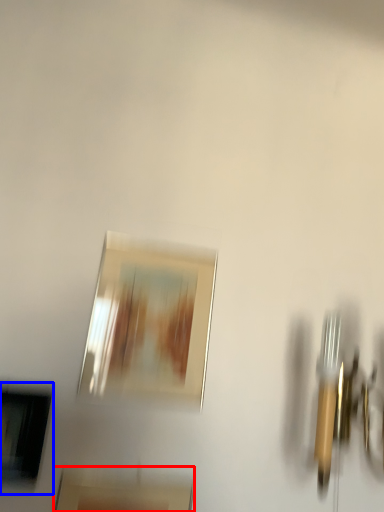
Question: Which of the following is the farthest to the observer, picture frame (highlighted by a red box) or picture frame (highlighted by a blue box)?

Choices:
 (A) picture frame
 (B) picture frame

Answer: (B)